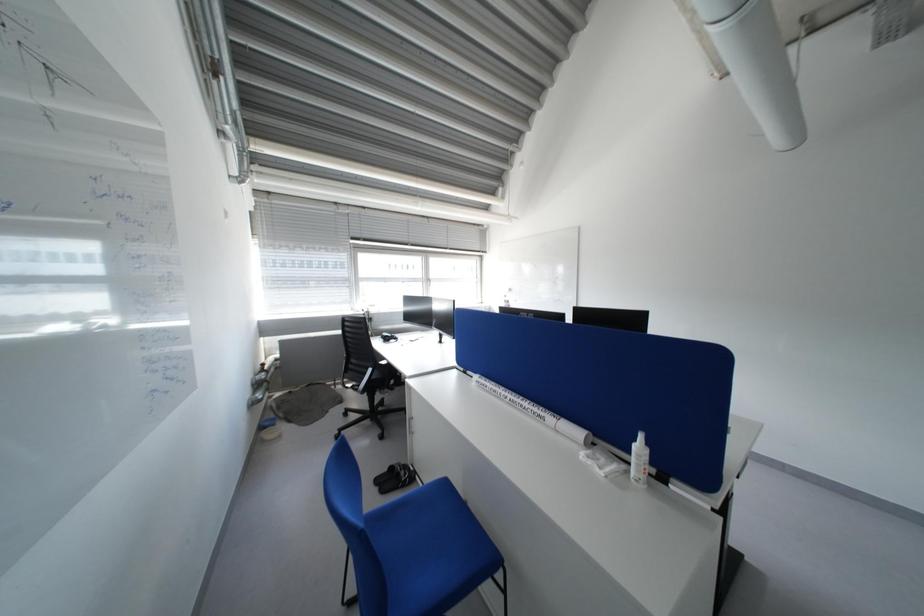
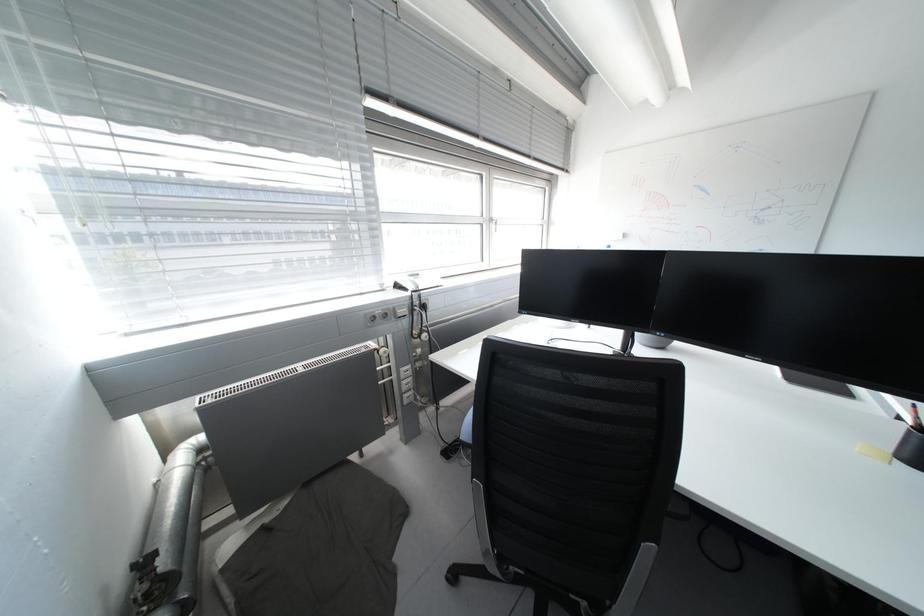
What movement of the cameraman would produce the second image?

The cameraman walked toward left, forward.